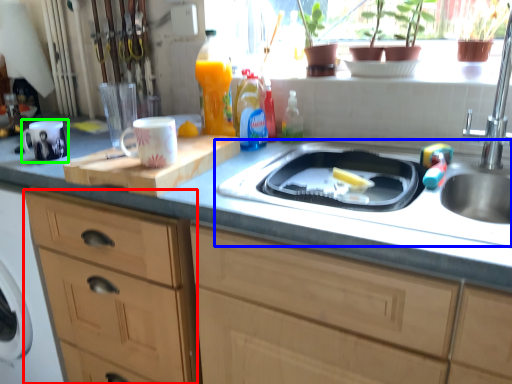
Question: Estimate the real-world distances between objects in this image. Which object is closer to cabinetry (highlighted by a red box), sink (highlighted by a blue box) or mug (highlighted by a green box)?

Choices:
 (A) sink
 (B) mug

Answer: (B)